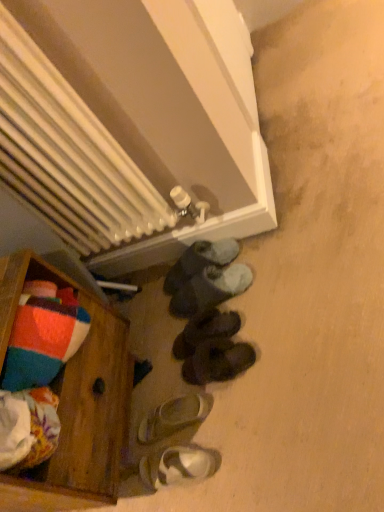
I want to click on free space to the back side of white matte sandal at lower center, which ranks as the 2th footwear in bottom-to-top order, so click(x=152, y=373).